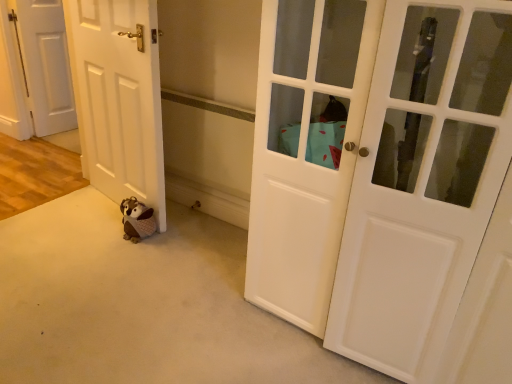
Question: Could you tell me if white glossy door at center, placed as the 3th door when sorted from left to right, is turned towards plush brown bear at lower left?

Choices:
 (A) no
 (B) yes

Answer: (A)

Question: Can you see white glossy door at center, placed as the 1th door when sorted from front to back, touching plush brown bear at lower left?

Choices:
 (A) yes
 (B) no

Answer: (B)

Question: Would you say white glossy door at center, which is counted as the 3th door, starting from the back, is outside plush brown bear at lower left?

Choices:
 (A) yes
 (B) no

Answer: (A)

Question: Does white glossy door at center, placed as the 1th door when sorted from front to back, appear on the right side of plush brown bear at lower left?

Choices:
 (A) yes
 (B) no

Answer: (A)

Question: Is white glossy door at center, placed as the 3th door when sorted from left to right, to the left of plush brown bear at lower left from the viewer's perspective?

Choices:
 (A) no
 (B) yes

Answer: (A)

Question: Considering the positions of white glossy door at center, placed as the 3th door when sorted from left to right, and plush brown bear at lower left in the image, is white glossy door at center, placed as the 3th door when sorted from left to right, wider or thinner than plush brown bear at lower left?

Choices:
 (A) thin
 (B) wide

Answer: (B)

Question: From the image's perspective, relative to plush brown bear at lower left, is white glossy door at center, acting as the 1th door starting from the right, above or below?

Choices:
 (A) above
 (B) below

Answer: (A)

Question: Considering the positions of white glossy door at center, placed as the 1th door when sorted from front to back, and plush brown bear at lower left in the image, is white glossy door at center, placed as the 1th door when sorted from front to back, taller or shorter than plush brown bear at lower left?

Choices:
 (A) short
 (B) tall

Answer: (B)

Question: Relative to plush brown bear at lower left, is white glossy door at center, acting as the 1th door starting from the right, in front or behind?

Choices:
 (A) front
 (B) behind

Answer: (A)

Question: Based on their positions, is white matte door at left, the second door in the back-to-front sequence, located to the left or right of plush brown bear at lower left?

Choices:
 (A) right
 (B) left

Answer: (B)

Question: Does point (95, 137) appear closer or farther from the camera than point (140, 218)?

Choices:
 (A) closer
 (B) farther

Answer: (B)

Question: In terms of height, does white matte door at left, arranged as the second door when viewed from the front, look taller or shorter compared to plush brown bear at lower left?

Choices:
 (A) tall
 (B) short

Answer: (A)

Question: Considering the positions of white matte door at left, arranged as the 2th door when viewed from the left, and plush brown bear at lower left in the image, is white matte door at left, arranged as the 2th door when viewed from the left, bigger or smaller than plush brown bear at lower left?

Choices:
 (A) big
 (B) small

Answer: (A)

Question: Considering the positions of white glossy door at center, acting as the 1th door starting from the right, and white matte door at left, the first door when ordered from back to front, in the image, is white glossy door at center, acting as the 1th door starting from the right, taller or shorter than white matte door at left, the first door when ordered from back to front,?

Choices:
 (A) short
 (B) tall

Answer: (B)

Question: Considering the positions of point (420, 41) and point (42, 122), is point (420, 41) closer or farther from the camera than point (42, 122)?

Choices:
 (A) closer
 (B) farther

Answer: (A)